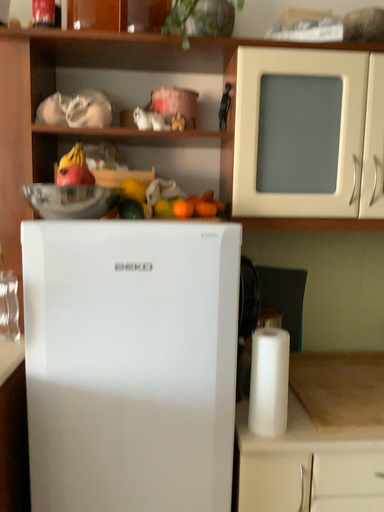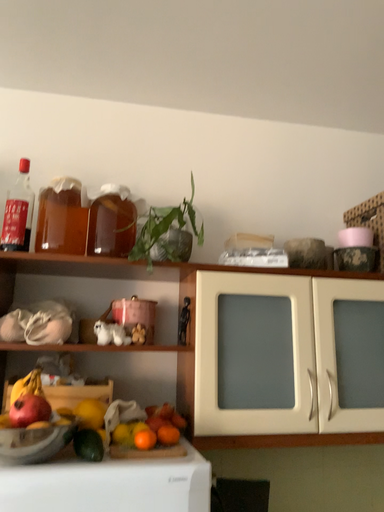
Question: Which way did the camera rotate in the video?

Choices:
 (A) rotated downward
 (B) rotated upward

Answer: (B)